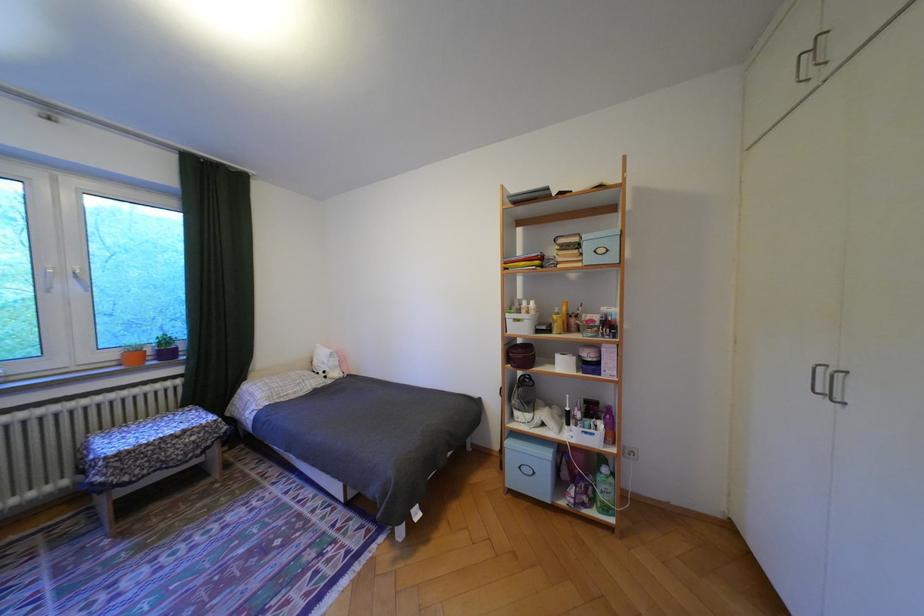
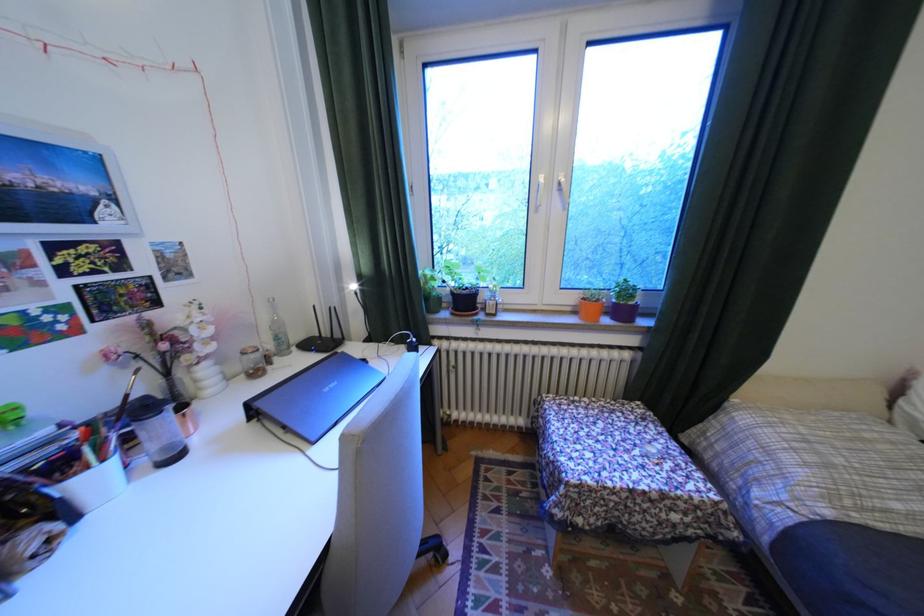
Find the pixel in the second image that matches (84,280) in the first image.

(566, 195)